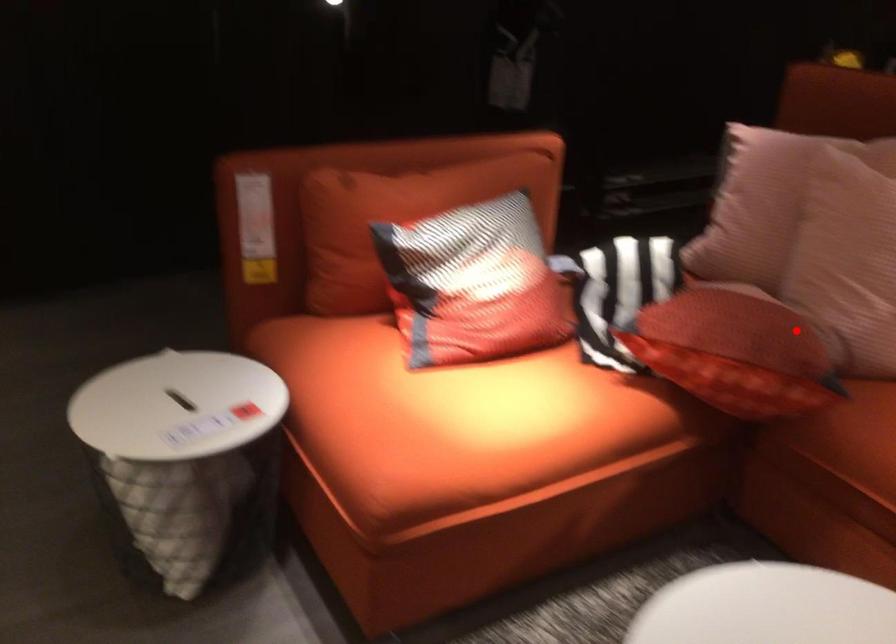
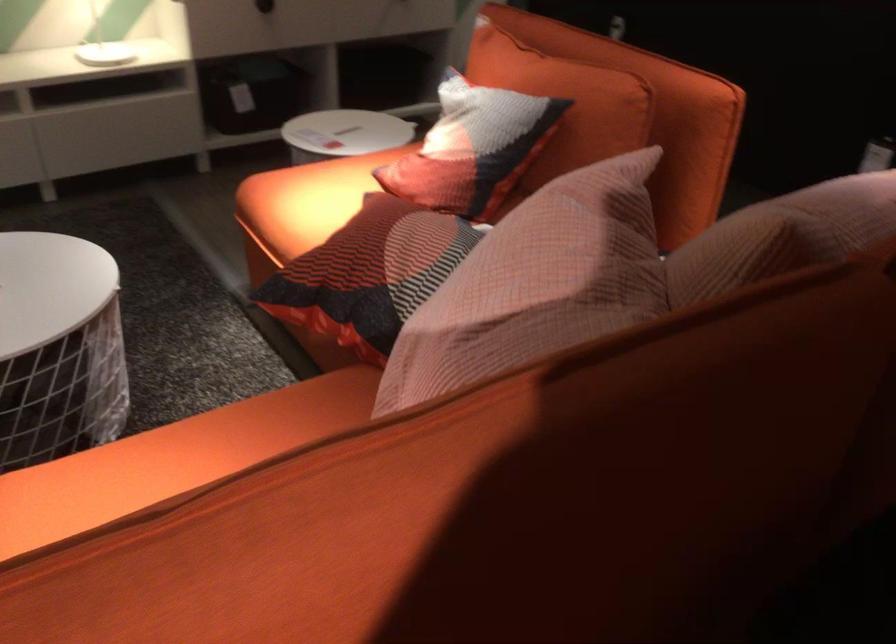
Locate, in the second image, the point that corresponds to the highlighted location in the first image.

(369, 274)